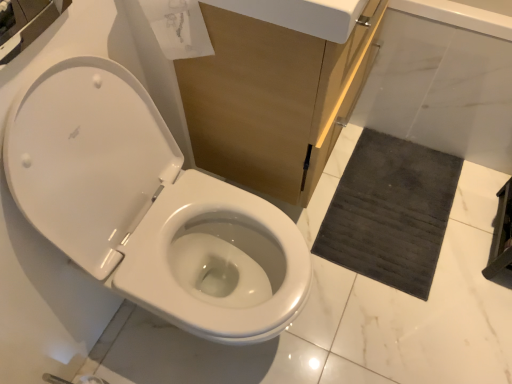
Locate an element on the screen. free spot in front of dark gray textured bath mat at lower right is located at coordinates (403, 320).